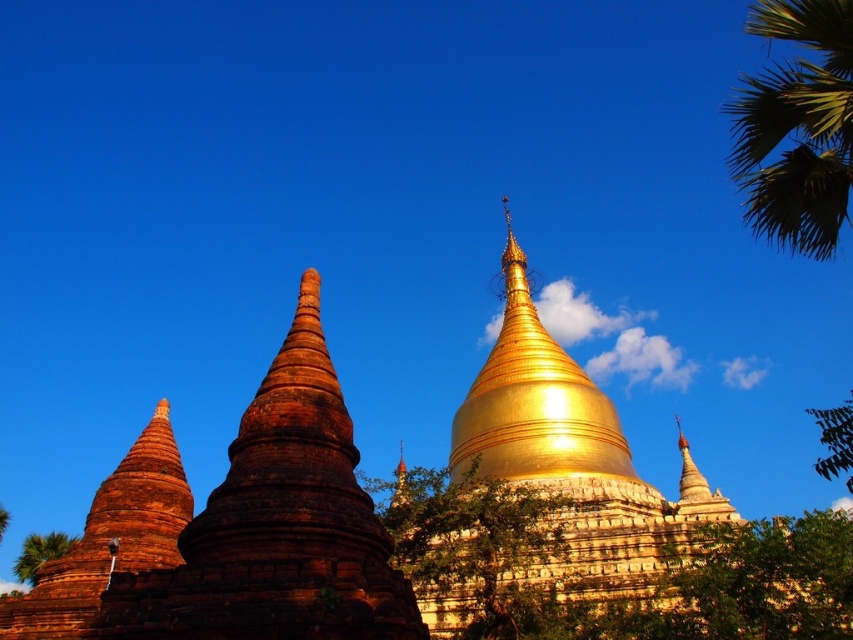
Question: Considering the relative positions of green leafy palm at upper right and green leafy palm tree at lower left in the image provided, where is green leafy palm at upper right located with respect to green leafy palm tree at lower left?

Choices:
 (A) left
 (B) right

Answer: (B)

Question: Among these objects, which one is farthest from the camera?

Choices:
 (A) green leafy tree at center
 (B) green leafy palm at upper right
 (C) polished wood spire at center

Answer: (C)

Question: Can you confirm if green leafy palm tree at lower left is positioned to the left of polished wood spire at center?

Choices:
 (A) yes
 (B) no

Answer: (A)

Question: Does green leafy palm at upper right come behind green leafy palm tree at lower left?

Choices:
 (A) yes
 (B) no

Answer: (B)

Question: Considering the real-world distances, which object is closest to the green leafy palm tree at lower left?

Choices:
 (A) green leafy tree at center
 (B) polished wood spire at center

Answer: (A)

Question: Which of these objects is positioned closest to the green leafy palm tree at lower left?

Choices:
 (A) green leafy tree at center
 (B) green leafy palm at upper right
 (C) polished wood spire at center

Answer: (A)